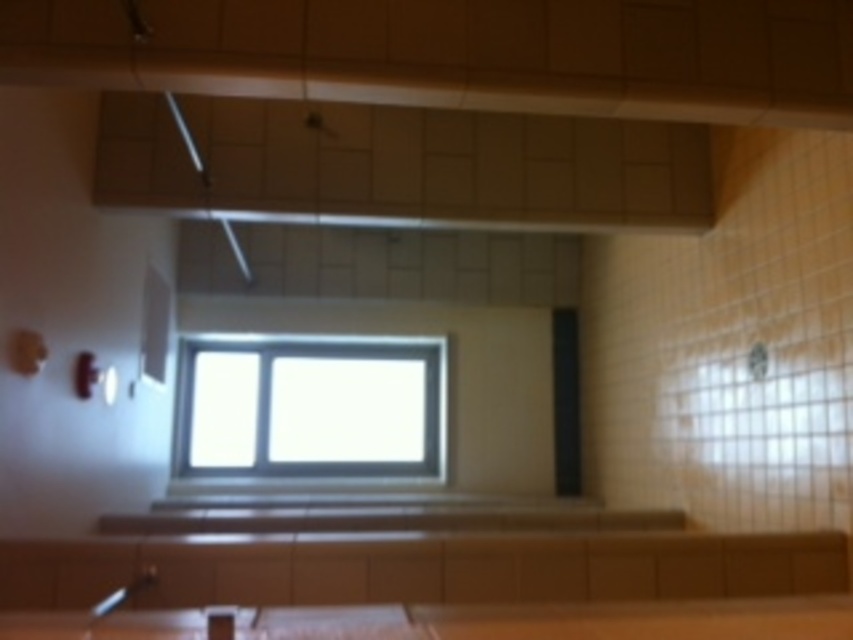
You are a delivery person carrying a package that is 3 meters long. You need to move it through the space between the clear glass window at center and the brown wood counter top at lower center. Can you fit the package through that space?

The distance between the clear glass window at center and the brown wood counter top at lower center is 3.39 meters. Since the package is 3 meters long, it can fit through the space as the distance is greater than the package length.

You are designing a kitchen layout and need to place a 1.2 meter wide appliance next to the brown wood counter top at lower center. Can the clear glass window at center accommodate this appliance in terms of width?

The clear glass window at center is wider than the brown wood counter top at lower center. Since the appliance is 1.2 meters wide, and the window is wider, it should have enough space to accommodate the appliance next to the brown wood counter top at lower center.

You are standing in the kitchen and want to place a small plant between the two points, point (334, 396) and point (614, 627). Since the plant needs to be closer to you, which point should you position it near?

You should position the plant near point (334, 396) because it is closer to you compared to point (614, 627), which is further away.